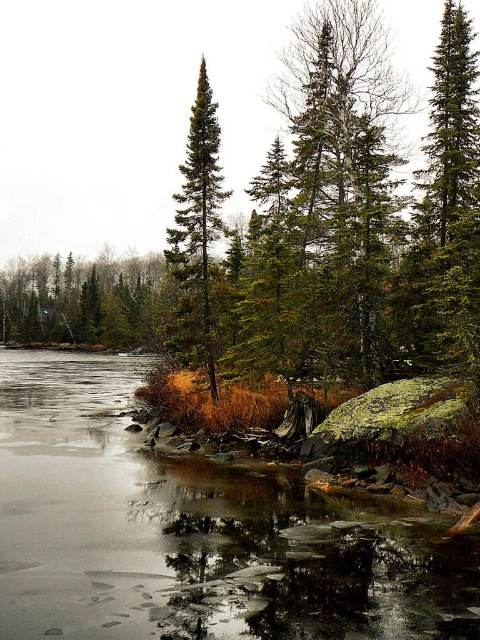
You are standing at point (x=452, y=195) in the winter landscape. What object is located at your current position?

The green matte evergreen tree at upper right is located at point (x=452, y=195).

You are a bird looking for a place to perch. You see the green matte evergreen tree at upper right and the green matte tree at upper left. Which tree would you choose if you prefer a taller perch?

The green matte evergreen tree at upper right is taller than the green matte tree at upper left, so you should choose the green matte evergreen tree at upper right for a taller perch.